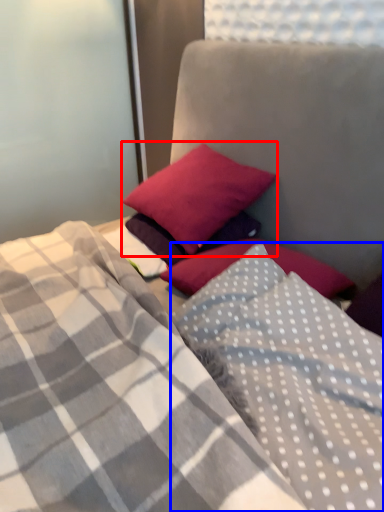
Question: Among these objects, which one is farthest to the camera, pillow (highlighted by a red box) or pillow (highlighted by a blue box)?

Choices:
 (A) pillow
 (B) pillow

Answer: (A)